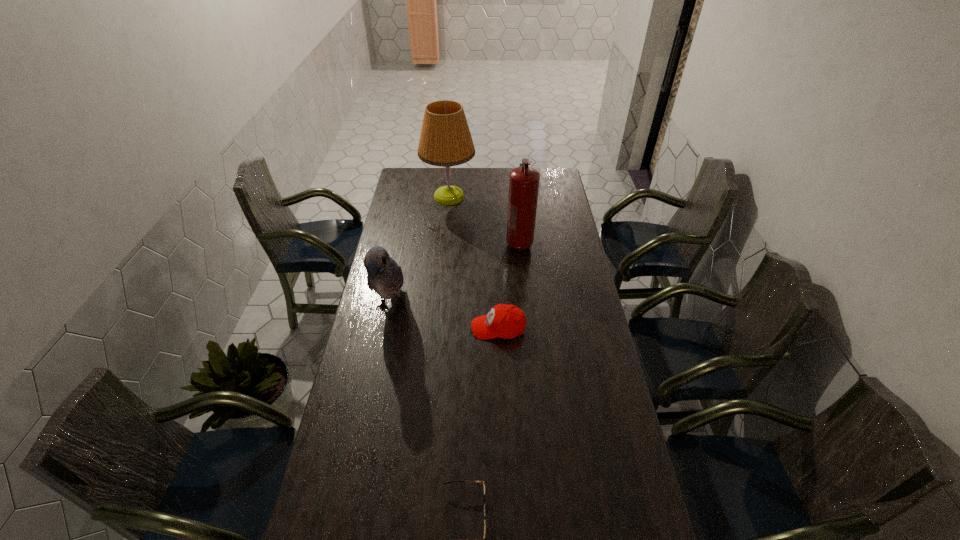
This screenshot has height=540, width=960. What are the coordinates of `empty space that is in between the fire extinguisher and the baseball cap` in the screenshot? It's located at (509, 286).

Identify the location of unoccupied area between the second farthest object and the third tallest object. This screenshot has width=960, height=540. (455, 276).

Identify the location of vacant space that is in between the fourth nearest object and the parrot. (455, 276).

Find the location of a particular element. This screenshot has width=960, height=540. free space between the second farthest object and the third tallest object is located at coordinates (455, 276).

This screenshot has height=540, width=960. Find the location of `unoccupied position between the third shortest object and the baseball cap`. unoccupied position between the third shortest object and the baseball cap is located at coordinates (444, 318).

This screenshot has height=540, width=960. Find the location of `object that stands as the closest to the shortest object`. object that stands as the closest to the shortest object is located at coordinates (505, 321).

Identify which object is the second closest to the parrot. Please provide its 2D coordinates. Your answer should be formatted as a tuple, i.e. [(x, y)], where the tuple contains the x and y coordinates of a point satisfying the conditions above.

[(523, 181)]

Locate an element on the screen. vacant region that satisfies the following two spatial constraints: 1. on the side of the lamp near the pull switch; 2. on the front-facing side of the third tallest object is located at coordinates (439, 308).